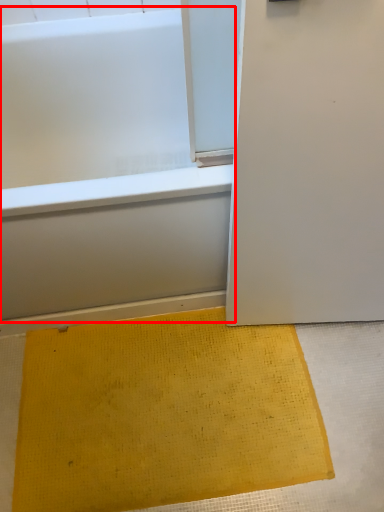
Question: From the image's perspective, considering the relative positions of bathtub (annotated by the red box) and doormat in the image provided, where is bathtub (annotated by the red box) located with respect to the staircase?

Choices:
 (A) below
 (B) above

Answer: (B)